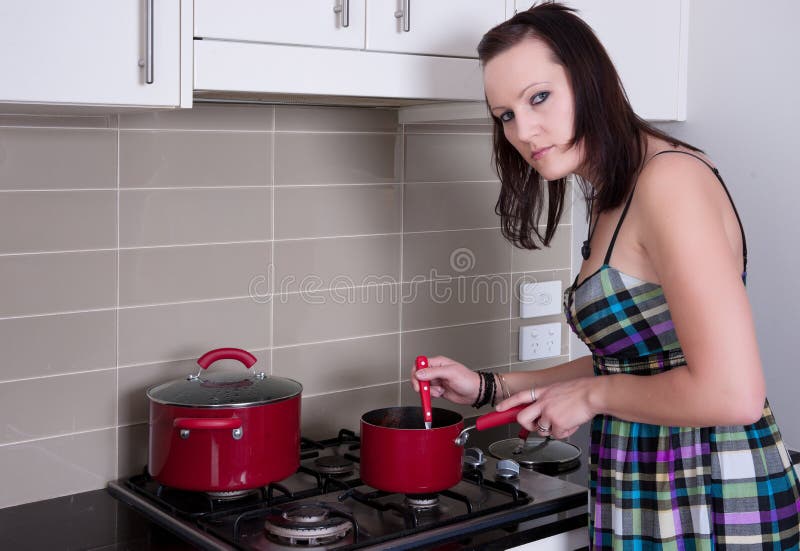
Locate an element on the screen. The width and height of the screenshot is (800, 551). burners is located at coordinates (310, 507), (329, 460), (422, 499), (220, 491).